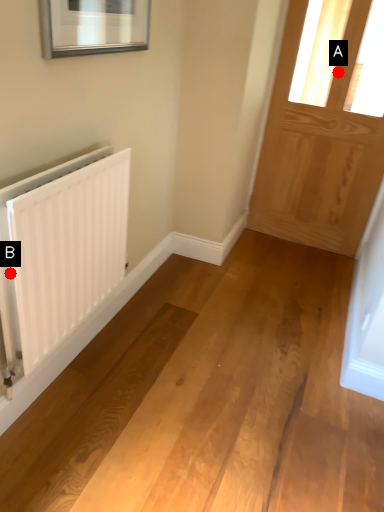
Question: Two points are circled on the image, labeled by A and B beside each circle. Which point is closer to the camera?

Choices:
 (A) A is closer
 (B) B is closer

Answer: (B)